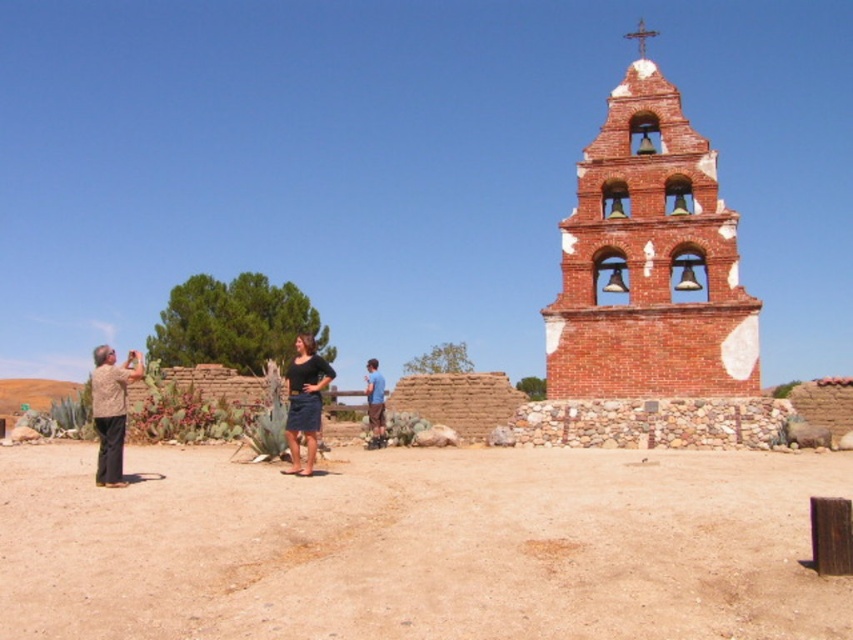
You are a photographer trying to capture the historic red brick bell tower. You notice two people in the foreground wearing a dark blue denim skirt at center and a blue cotton shirt at center. Which clothing item is positioned more to the left side of the scene?

The dark blue denim skirt at center is positioned more to the left side of the scene compared to the blue cotton shirt at center, as it is located to the left of it.

You are a photographer trying to capture the historic red brick bell tower. You notice the brown sandy dirt at lower center and the dark blue denim skirt at center in your frame. Which object is located lower in the image?

The brown sandy dirt at lower center is positioned under the dark blue denim skirt at center, so it is located lower in the image.

You are a photographer who wants to capture the historic red brick bell tower in the background. You see the brown sandy dirt at lower center and the blue cotton shirt at center. Which object is closer to the camera?

The brown sandy dirt at lower center is located below the blue cotton shirt at center, so the blue cotton shirt at center is closer to the camera.